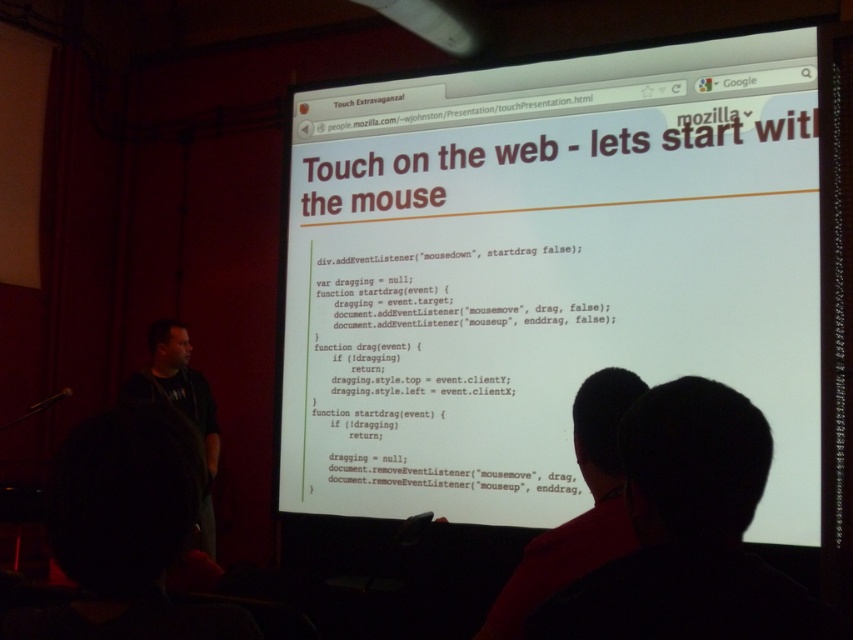
You are a photographer standing in front of the presentation screen. You notice a white paper at center and a black hair at upper center. Which object is closer to the camera?

The white paper at center is positioned over the black hair at upper center, so it is closer to the camera.

You are an attendee at the presentation and notice two items of interest in the scene. One is the white paper at center and the other is the dark gray shirt at left. From your perspective, which item is positioned to the right of the other?

The white paper at center is to the right of the dark gray shirt at left.

You are an attendee sitting in the audience and want to take a photo of the presentation screen. You notice two points on the screen marked as point 1 at coordinates (639, 52) and point 2 at coordinates (751, 577). Which point is closer to you when you look at the screen?

Point (639, 52) is closer to you than point (751, 577) because it is further to the viewer according to the description.